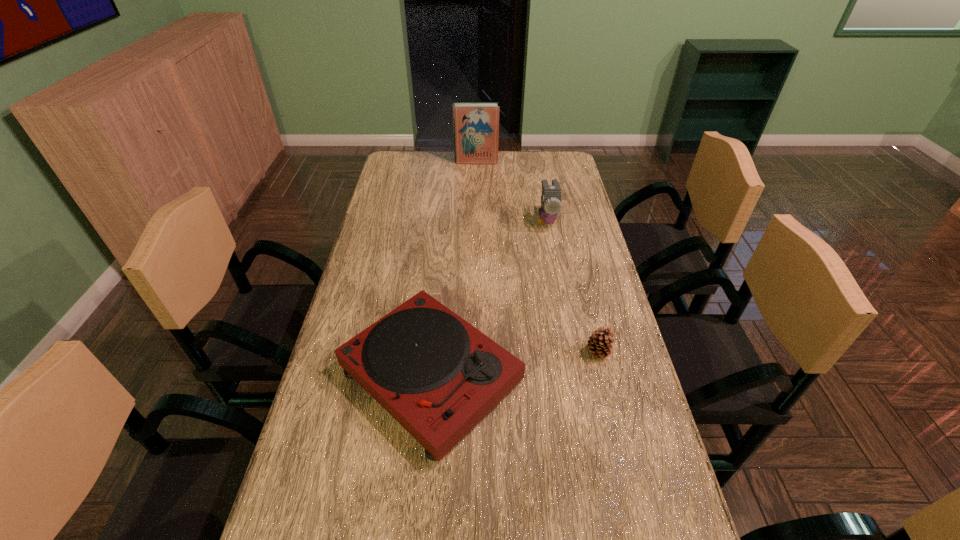
You are a GUI agent. You are given a task and a screenshot of the screen. Output one action in this format:
    pyautogui.click(x=<x>, y=<y>)
    Task: Click on the vacant region between the rightmost object and the tallest object
    
    Given the screenshot: What is the action you would take?
    pyautogui.click(x=537, y=257)

Where is `free spot between the rightmost object and the farthest object`? The height and width of the screenshot is (540, 960). free spot between the rightmost object and the farthest object is located at coordinates (537, 257).

Image resolution: width=960 pixels, height=540 pixels. I want to click on free spot between the third shortest object and the tallest object, so (512, 191).

Where is `unoccupied position between the second object from right to left and the tallest object`? unoccupied position between the second object from right to left and the tallest object is located at coordinates (512, 191).

Locate an element on the screen. This screenshot has height=540, width=960. empty space that is in between the second tallest object and the record player is located at coordinates (489, 298).

Identify the location of vacant space that is in between the hardback book and the record player. The image size is (960, 540). (453, 268).

At what (x,y) coordinates should I click in order to perform the action: click on blank region between the pinecone and the second tallest object. Please return your answer as a coordinate pair (x, y). This screenshot has height=540, width=960. Looking at the image, I should click on (572, 286).

Find the location of `free point between the tallest object and the record player`. free point between the tallest object and the record player is located at coordinates [453, 268].

Choose which object is the third nearest neighbor to the record player. Please provide its 2D coordinates. Your answer should be formatted as a tuple, i.e. [(x, y)], where the tuple contains the x and y coordinates of a point satisfying the conditions above.

[(476, 125)]

This screenshot has width=960, height=540. I want to click on the third closest object to the record player, so click(476, 125).